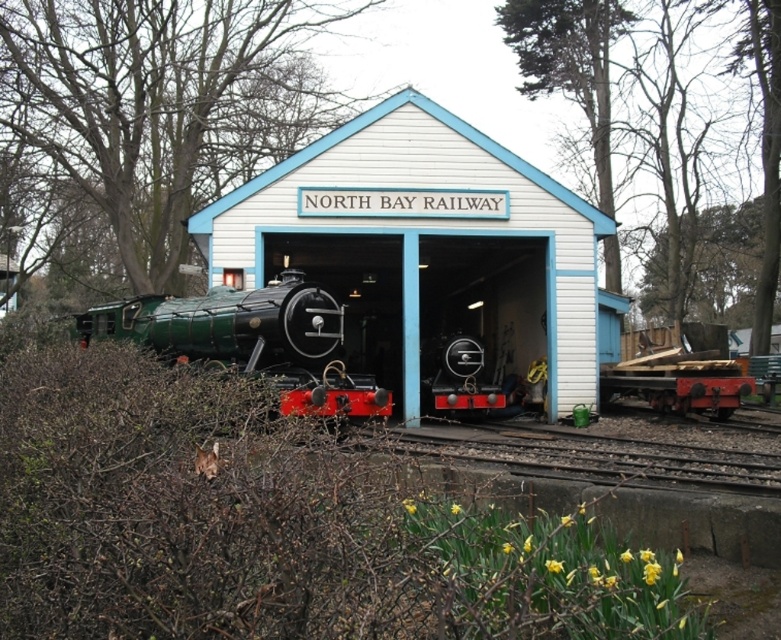
Question: Is white wooden railway station at center above green polished wood train at center?

Choices:
 (A) no
 (B) yes

Answer: (B)

Question: Is white wooden railway station at center below green polished wood train at center?

Choices:
 (A) no
 (B) yes

Answer: (A)

Question: Among these objects, which one is farthest from the camera?

Choices:
 (A) green polished wood train at center
 (B) white wooden railway station at center

Answer: (B)

Question: Considering the relative positions of white wooden railway station at center and green polished wood train at center in the image provided, where is white wooden railway station at center located with respect to green polished wood train at center?

Choices:
 (A) left
 (B) right

Answer: (B)

Question: Which of the following is the farthest from the observer?

Choices:
 (A) white wooden railway station at center
 (B) green polished wood train at center

Answer: (A)

Question: Which object is closer to the camera taking this photo?

Choices:
 (A) green polished wood train at center
 (B) white wooden railway station at center

Answer: (A)